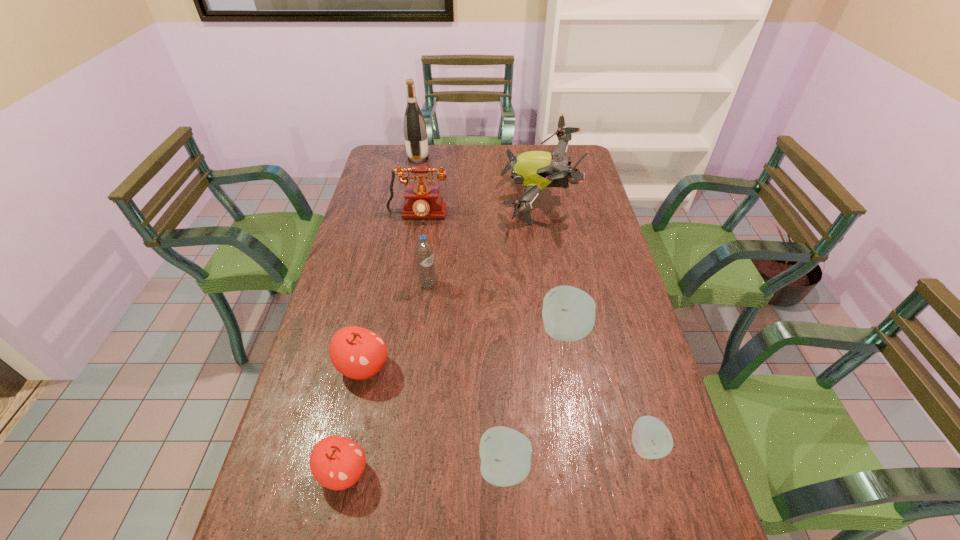
Locate an element on the screen. The image size is (960, 540). the tallest object is located at coordinates (415, 132).

Locate an element on the screen. This screenshot has height=540, width=960. wine bottle is located at coordinates (415, 132).

This screenshot has width=960, height=540. Identify the location of drone. (536, 170).

You are a GUI agent. You are given a task and a screenshot of the screen. Output one action in this format:
    pyautogui.click(x=<x>, y=<y>)
    Task: Click on the green drone
    Image resolution: width=960 pixels, height=540 pixels.
    Given the screenshot: What is the action you would take?
    pyautogui.click(x=536, y=170)

I want to click on telephone, so click(x=421, y=201).

Where is `the sixth nearest object`? the sixth nearest object is located at coordinates (424, 253).

Where is `water bottle`? water bottle is located at coordinates (424, 253).

Locate an element on the screen. The height and width of the screenshot is (540, 960). the biggest white apple is located at coordinates (568, 313).

The image size is (960, 540). I want to click on the farthest white apple, so click(568, 313).

Identify the location of the bigger red apple. This screenshot has height=540, width=960. (358, 353).